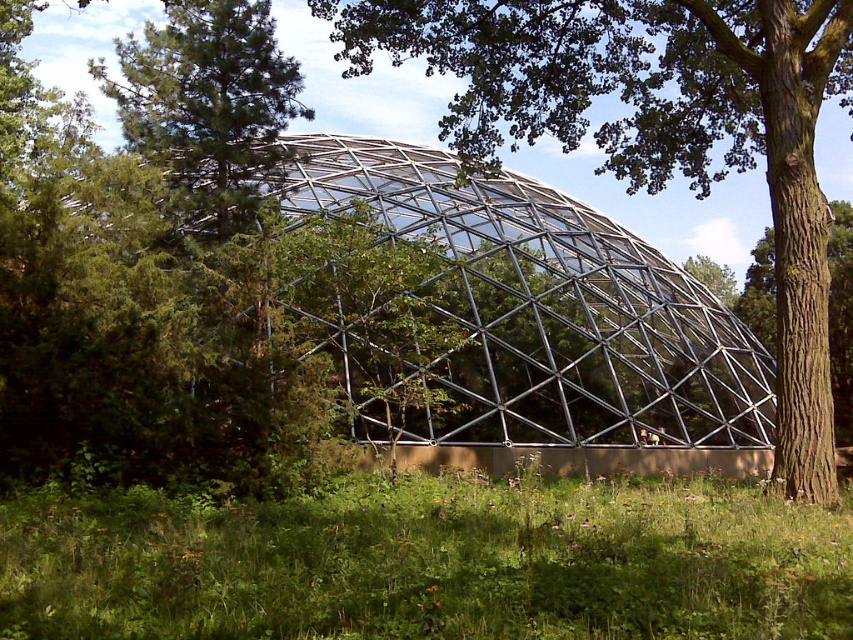
Question: Which point is farther from the camera taking this photo?

Choices:
 (A) (486, 49)
 (B) (846, 209)

Answer: (B)

Question: Which point is closer to the camera taking this photo?

Choices:
 (A) (796, 243)
 (B) (660, 612)
 (C) (747, 321)
 (D) (184, 212)

Answer: (B)

Question: Is green grass at center bigger than green leafy tree at upper left?

Choices:
 (A) no
 (B) yes

Answer: (A)

Question: Is brown rough tree at center smaller than brown rough bark tree at right?

Choices:
 (A) yes
 (B) no

Answer: (B)

Question: Observing the image, what is the correct spatial positioning of green grass at center in reference to brown rough tree at center?

Choices:
 (A) below
 (B) above

Answer: (A)

Question: Which object is the farthest from the brown rough bark tree at right?

Choices:
 (A) green leafy tree at upper left
 (B) green grass at center

Answer: (A)